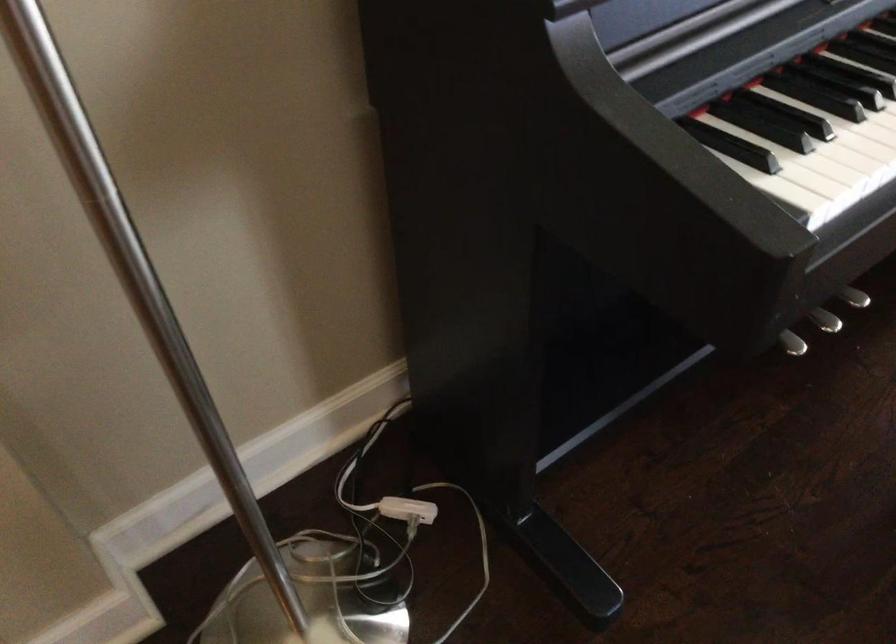
Where is `white piano key`? This screenshot has height=644, width=896. white piano key is located at coordinates (851, 196).